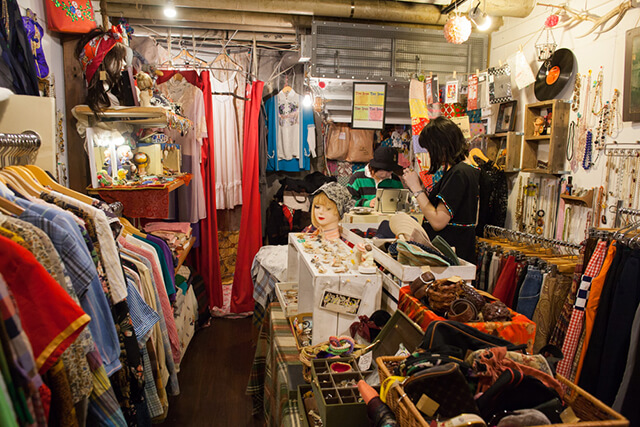
Where is `white drawer`? The height and width of the screenshot is (427, 640). white drawer is located at coordinates (365, 285).